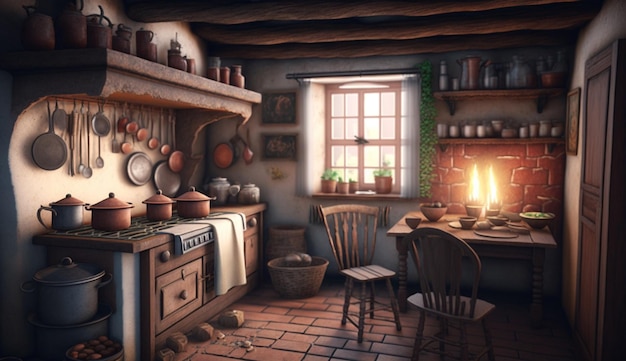
I want to click on left flower pot, so click(327, 190).